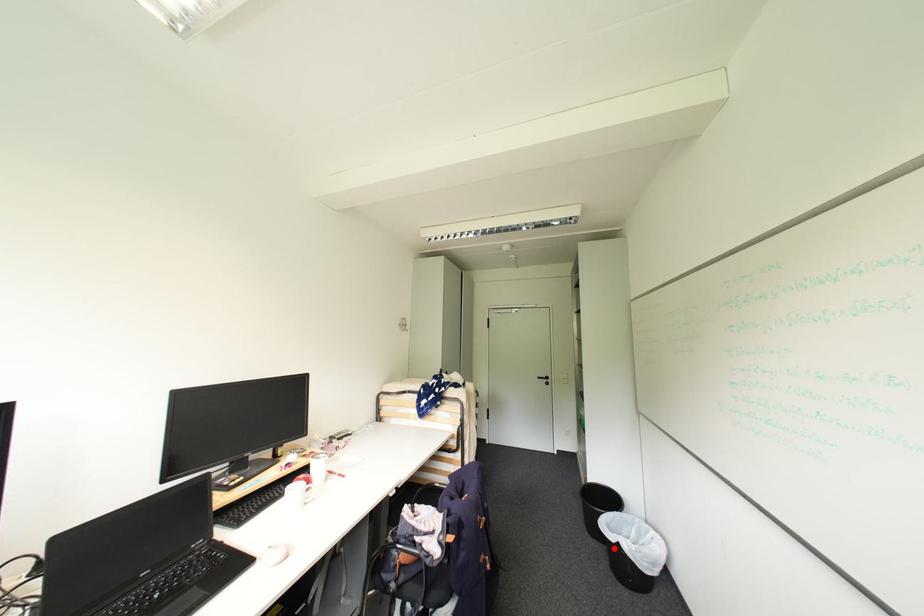
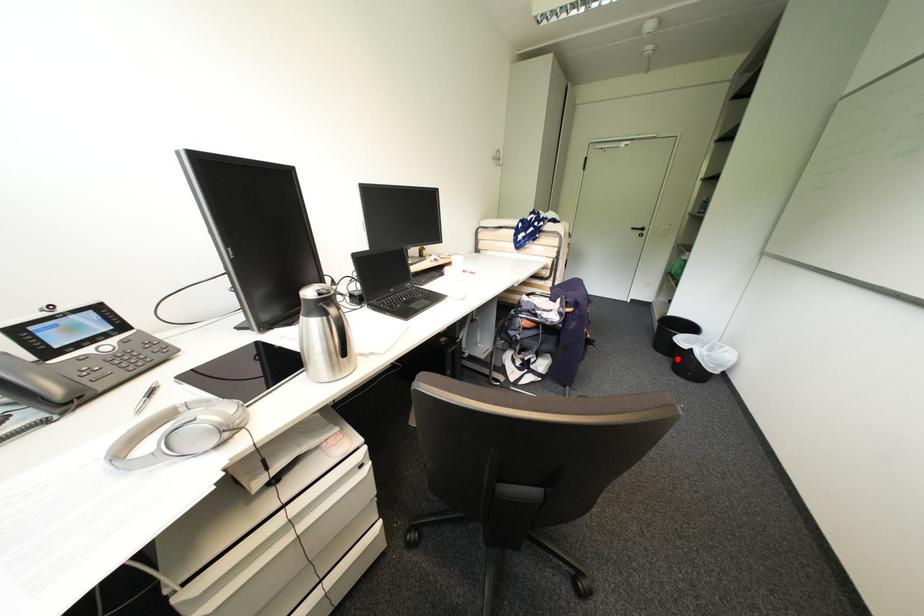
From the picture: I am providing you with two images of the same scene from different viewpoints. A red point is marked on the first image and another point is marked on the second image. Is the red point in image1 aligned with the point shown in image2?

Yes